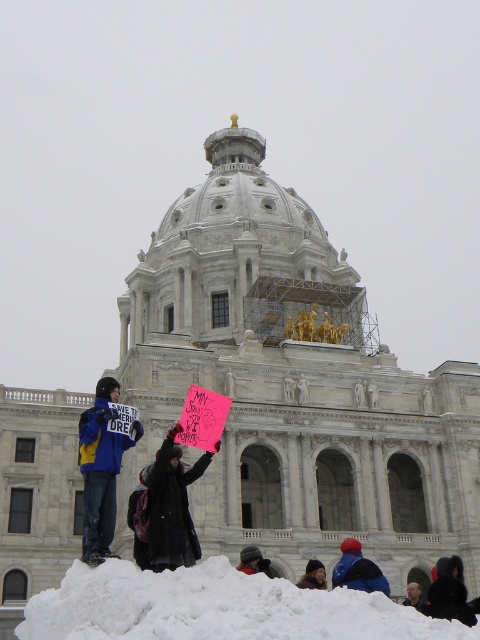
From the picture: You are a photographer trying to capture the protest sign held by the person in the black wool coat at center. Since the white fluffy snow at lower center is blocking your view, can you move around to get a clear shot of the sign without the snow in the frame?

The white fluffy snow at lower center is in front of the black wool coat at center, so moving behind the snow or to the side might allow you to see the sign clearly without the snow blocking the view.

You are a photographer wanting to capture the grand neoclassical building with its dome and the protesters holding signs in the foreground. Where should you position your camera to ensure the white fluffy snow at lower center is visible in the shot?

Position the camera so that the white fluffy snow at lower center, located at coordinates approximately 0.950 on the x axis and 0.452 on the y axis, is within the frame. This placement will allow the snow to be visible while capturing the building and protesters in the foreground.